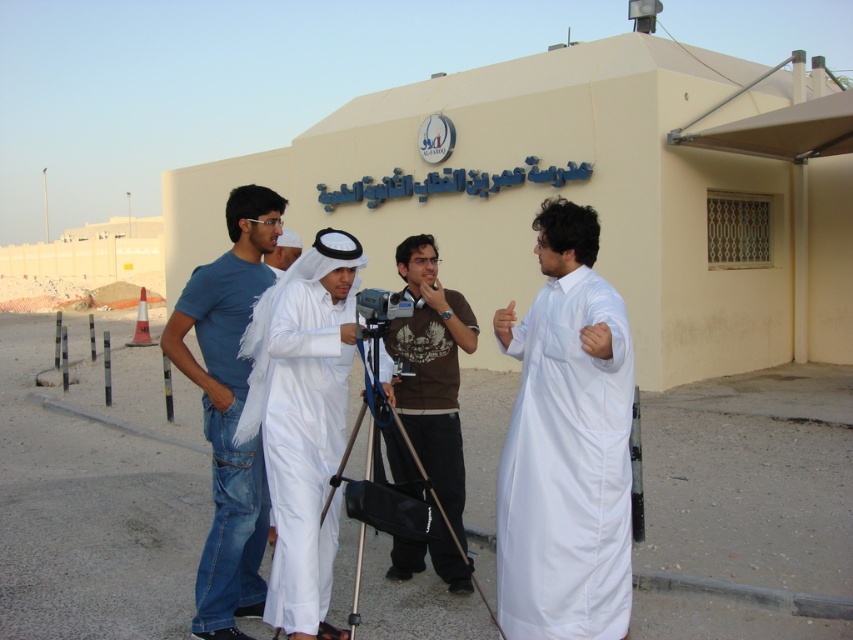
Between white matte dress at center and brown cotton t-shirt at center, which one is positioned lower?

Positioned lower is white matte dress at center.

Does white matte dress at center come in front of brown cotton t-shirt at center?

Yes, it is.

What are the coordinates of `white matte dress at center` in the screenshot? It's located at (567, 468).

Locate an element on the screen. The image size is (853, 640). white matte dress at center is located at coordinates (567, 468).

Can you confirm if white matte dress at center is taller than blue denim jeans at center?

No, white matte dress at center is not taller than blue denim jeans at center.

Can you confirm if white matte dress at center is thinner than blue denim jeans at center?

Indeed, white matte dress at center has a lesser width compared to blue denim jeans at center.

Does point (503, 497) come farther from viewer compared to point (190, 365)?

No.

Locate an element on the screen. The image size is (853, 640). white matte dress at center is located at coordinates (567, 468).

Measure the distance between point [630,477] and camera.

Point [630,477] and camera are 12.71 feet apart from each other.

Can you confirm if white matte dress at center is positioned below black plastic tripod at center?

No.

This screenshot has height=640, width=853. What are the coordinates of `white matte dress at center` in the screenshot? It's located at (567, 468).